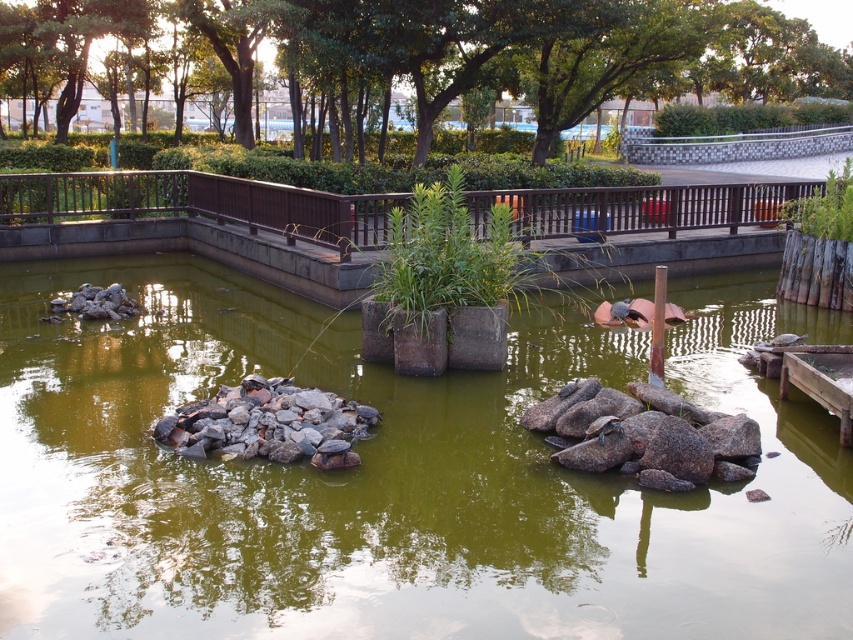
You are designing a path around the pond and need to know the relative sizes of the green murky water at center and the gray rock at center. Which one is wider?

The green murky water at center is wider than the gray rock at center according to the description.

You are a small frog trying to jump from the gray rock at left to the gray rock at center. Based on the scene description, can you safely make the jump?

The gray rock at center is wider than the gray rock at left, so the distance between them may be manageable for the frog to jump safely.

You are standing on the walkway and notice two rocks in the pond. The brown rough rock at center and the gray rock at center. Which one is positioned to the right of the other?

The brown rough rock at center is to the right of the gray rock at center.